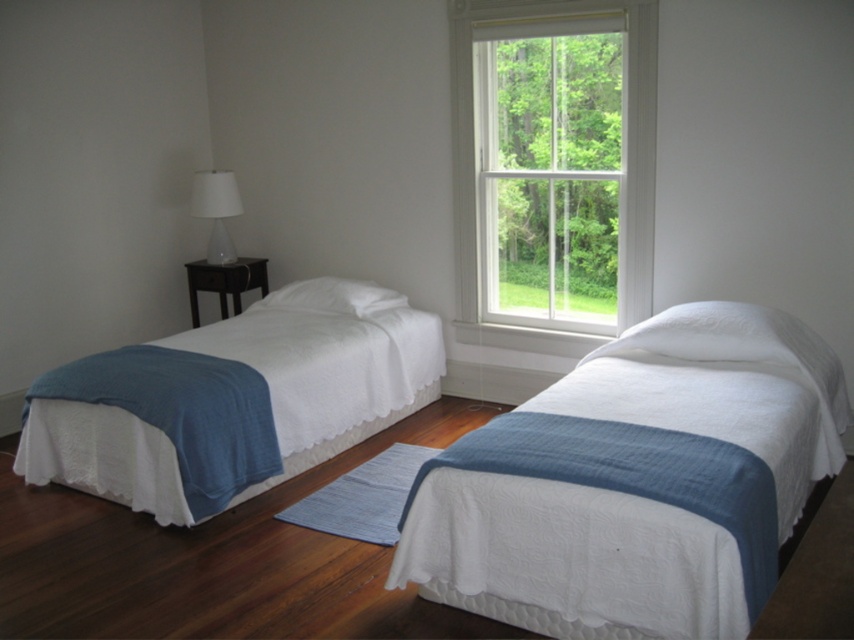
Question: Which point is closer to the camera taking this photo?

Choices:
 (A) (401, 342)
 (B) (238, 193)
 (C) (753, 412)
 (D) (370, 310)

Answer: (C)

Question: Is clear glass window at center closer to camera compared to white quilted bed at left?

Choices:
 (A) yes
 (B) no

Answer: (B)

Question: Which of these objects is positioned farthest from the white soft pillow at center?

Choices:
 (A) white quilted bed at left
 (B) white matte lamp at left
 (C) white quilted bed at center

Answer: (C)

Question: Is clear glass window at center to the right of white quilted bed at left from the viewer's perspective?

Choices:
 (A) yes
 (B) no

Answer: (A)

Question: Which of the following is the closest to the observer?

Choices:
 (A) clear glass window at center
 (B) white matte lamp at left
 (C) white quilted bed at center

Answer: (C)

Question: Does white quilted bed at left have a greater width compared to white soft pillow at center?

Choices:
 (A) no
 (B) yes

Answer: (B)